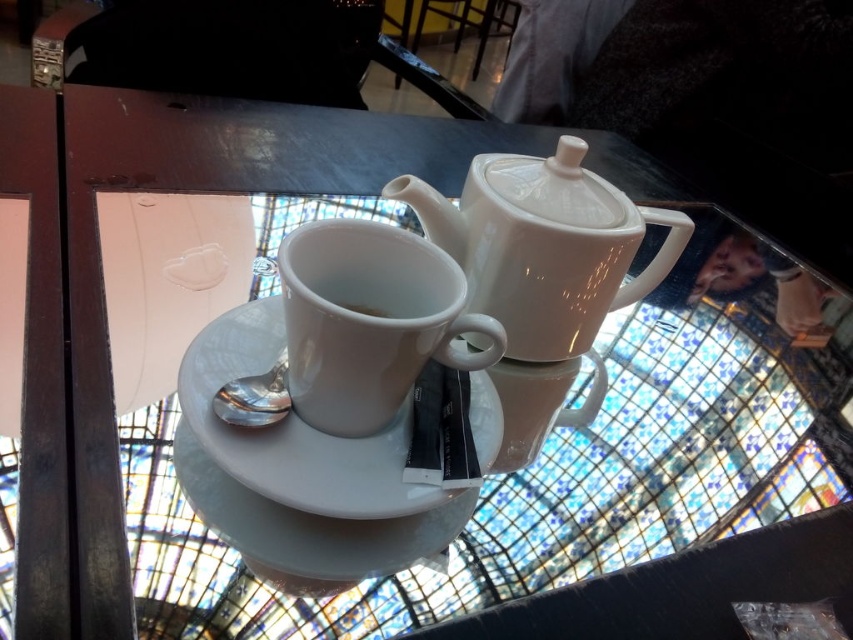
Question: From the image, what is the correct spatial relationship of white glossy mug at center in relation to white porcelain cup at center?

Choices:
 (A) below
 (B) above

Answer: (A)

Question: Which point is farther to the camera?

Choices:
 (A) (374, 314)
 (B) (363, 493)
 (C) (618, 234)

Answer: (C)

Question: Does white glossy teapot at upper center appear over white glossy mug at center?

Choices:
 (A) yes
 (B) no

Answer: (A)

Question: Which object is farther from the camera taking this photo?

Choices:
 (A) white porcelain cup at center
 (B) white glossy mug at center
 (C) white glossy teapot at upper center
 (D) white ceramic saucer at center

Answer: (C)

Question: Which object is farther from the camera taking this photo?

Choices:
 (A) white glossy mug at center
 (B) white porcelain cup at center

Answer: (B)

Question: Can you confirm if white glossy teapot at upper center is positioned to the left of white porcelain cup at center?

Choices:
 (A) no
 (B) yes

Answer: (A)